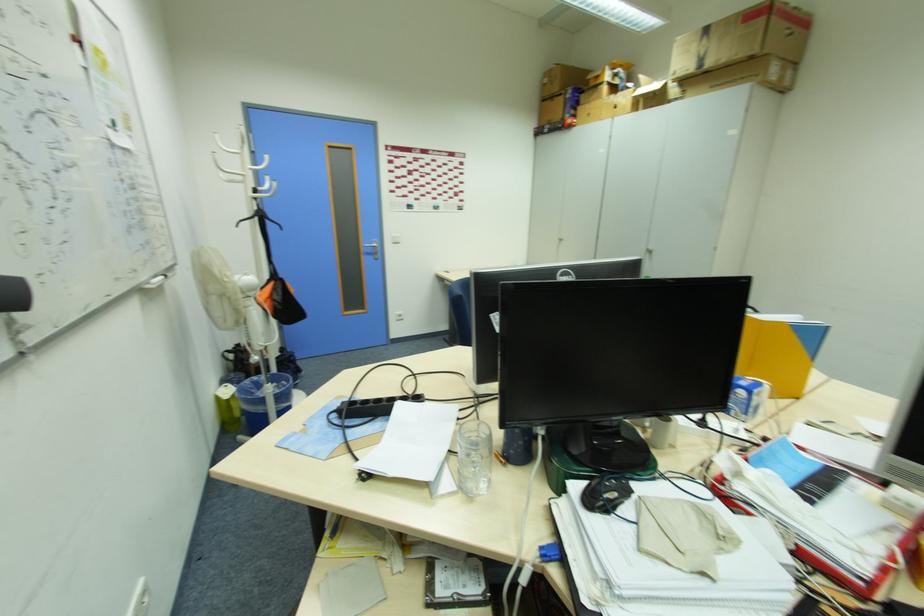
Locate an element on the screen. Image resolution: width=924 pixels, height=616 pixels. black computer mouse is located at coordinates (604, 493).